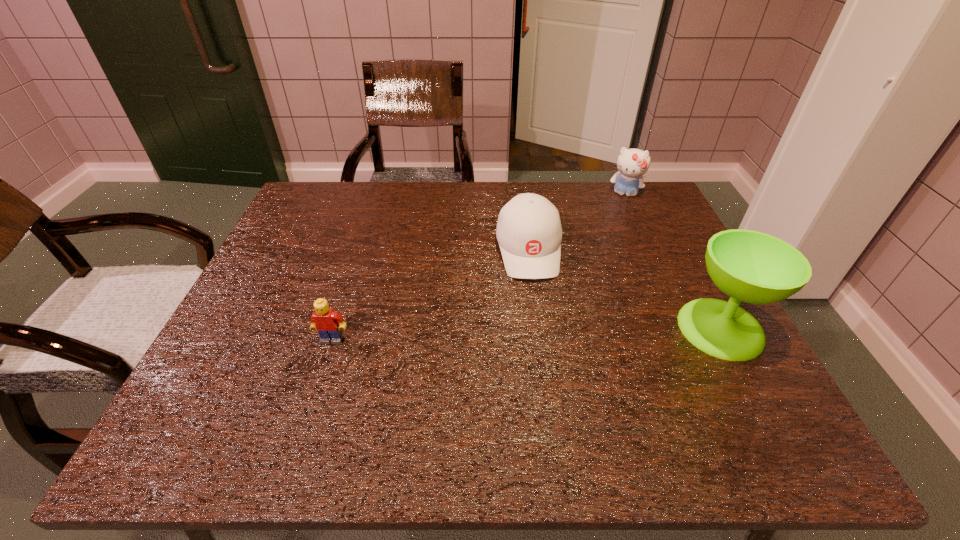
Image resolution: width=960 pixels, height=540 pixels. I want to click on vacant space located on the front-facing side of the farthest object, so click(606, 252).

Identify the location of free space located 0.320m on the front-facing side of the farthest object. This screenshot has height=540, width=960. (603, 264).

Identify the location of blank space located on the front-facing side of the farthest object. (603, 261).

You are a GUI agent. You are given a task and a screenshot of the screen. Output one action in this format:
    pyautogui.click(x=<x>, y=<y>)
    Task: Click on the baseball cap at the far edge
    Image resolution: width=960 pixels, height=540 pixels.
    Given the screenshot: What is the action you would take?
    pyautogui.click(x=529, y=233)

Identify the location of kitten at the far edge. (632, 163).

The image size is (960, 540). I want to click on wineglass located in the right edge section of the desktop, so click(753, 267).

Where is `kitten positioned at the right edge`? kitten positioned at the right edge is located at coordinates (632, 163).

I want to click on object located at the far right corner, so [x=632, y=163].

This screenshot has height=540, width=960. Identify the location of free space at the far edge. (447, 221).

Locate an element on the screen. blank space at the near edge is located at coordinates (311, 372).